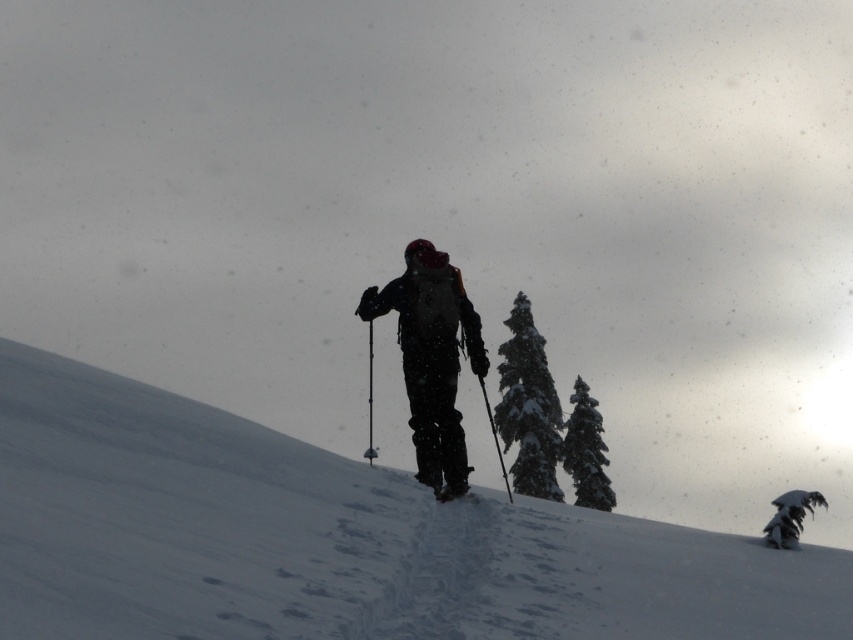
Who is more forward, (367, 500) or (581, 404)?

Point (367, 500) is in front.

Does white fluffy snow at center come behind green textured pine tree at upper right?

No.

This screenshot has width=853, height=640. What are the coordinates of `white fluffy snow at center` in the screenshot? It's located at (334, 540).

You are a GUI agent. You are given a task and a screenshot of the screen. Output one action in this format:
    pyautogui.click(x=<x>, y=<y>)
    Task: Click on the white fluffy snow at center
    This screenshot has height=640, width=853.
    Given the screenshot: What is the action you would take?
    (x=334, y=540)

Who is higher up, dark matte ski suit at center or matte black ski at center?

dark matte ski suit at center

The image size is (853, 640). Describe the element at coordinates (431, 355) in the screenshot. I see `dark matte ski suit at center` at that location.

This screenshot has width=853, height=640. What are the coordinates of `dark matte ski suit at center` in the screenshot? It's located at (431, 355).

Is point (552, 380) farther from viewer compared to point (796, 525)?

Yes, it is behind point (796, 525).

Does snowy evergreen tree at center appear over snow-covered pine tree at center?

No.

Where is `snowy evergreen tree at center`? snowy evergreen tree at center is located at coordinates (527, 406).